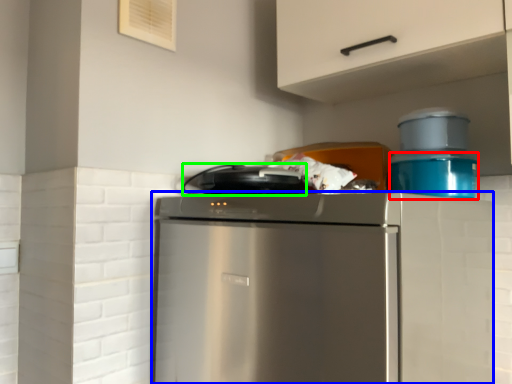
Question: Estimate the real-world distances between objects in this image. Which object is closer to appliance (highlighted by a red box), home appliance (highlighted by a blue box) or appliance (highlighted by a green box)?

Choices:
 (A) home appliance
 (B) appliance

Answer: (B)